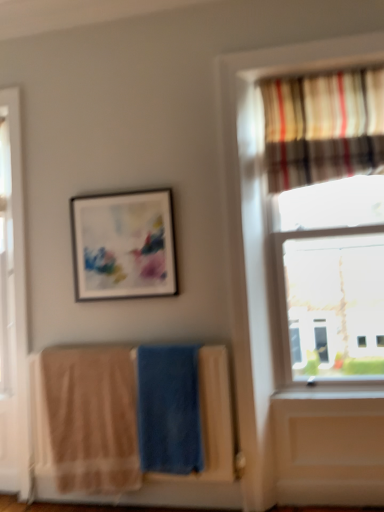
Question: Is blue soft towel at center, placed as the 2th beach towel when sorted from left to right, situated inside beige cotton towels at lower left or outside?

Choices:
 (A) inside
 (B) outside

Answer: (A)

Question: From their relative heights in the image, would you say blue soft towel at center, placed as the 2th beach towel when sorted from left to right, is taller or shorter than beige cotton towels at lower left?

Choices:
 (A) tall
 (B) short

Answer: (B)

Question: Based on their relative distances, which object is farther from the beige cotton towels at lower left?

Choices:
 (A) beige cotton beach towel at lower left, which is the second beach towel from right to left
 (B) matte black picture frame at upper center
 (C) blue soft towel at center, placed as the 2th beach towel when sorted from left to right
 (D) striped fabric curtain at upper right

Answer: (D)

Question: Based on their relative distances, which object is nearer to the striped fabric curtain at upper right?

Choices:
 (A) beige cotton beach towel at lower left, which is the second beach towel from right to left
 (B) blue soft towel at center, acting as the first beach towel starting from the right
 (C) beige cotton towels at lower left
 (D) matte black picture frame at upper center

Answer: (D)